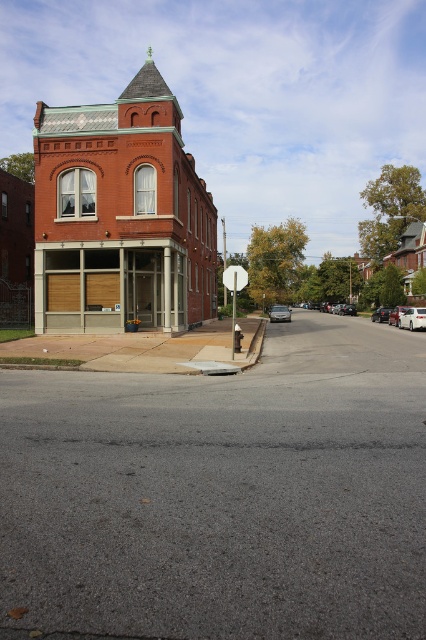
Question: Which object is the farthest from the asphalt at center?

Choices:
 (A) satin silver sedan at center
 (B) metallic silver sedan at center
 (C) white glossy sedan at right

Answer: (A)

Question: Considering the relative positions of asphalt at center and satin silver sedan at center in the image provided, where is asphalt at center located with respect to satin silver sedan at center?

Choices:
 (A) below
 (B) above

Answer: (A)

Question: Is white plastic stop sign at center below shiny black sedan at center?

Choices:
 (A) no
 (B) yes

Answer: (B)

Question: Among these points, which one is farthest from the camera?

Choices:
 (A) (400, 307)
 (B) (226, 276)
 (C) (402, 323)

Answer: (A)

Question: Which object is farther from the camera taking this photo?

Choices:
 (A) white plastic stop sign at center
 (B) metallic silver sedan at center
 (C) silver metallic sedan at center
 (D) asphalt at center

Answer: (B)

Question: Is asphalt at center smaller than metallic silver sedan at center?

Choices:
 (A) yes
 (B) no

Answer: (B)